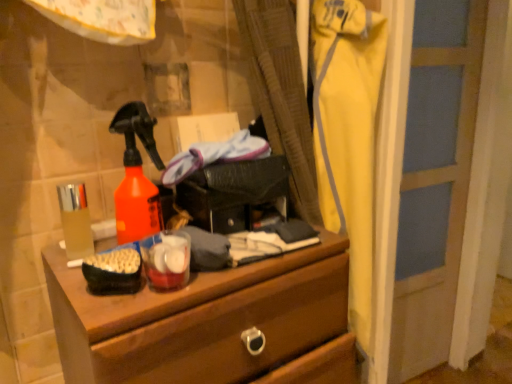
Find the location of a particular element. This screenshot has height=384, width=512. wooden chest of drawers at center is located at coordinates (x=201, y=320).

In the scene shown: Considering the relative positions of wooden chest of drawers at center and yellow fabric pants at right in the image provided, is wooden chest of drawers at center to the left of yellow fabric pants at right from the viewer's perspective?

Indeed, wooden chest of drawers at center is positioned on the left side of yellow fabric pants at right.

You are a GUI agent. You are given a task and a screenshot of the screen. Output one action in this format:
    pyautogui.click(x=<x>, y=<y>)
    Task: Click on the clothing that appears above the wooden chest of drawers at center (from a real-world perspective)
    
    Given the screenshot: What is the action you would take?
    pyautogui.click(x=348, y=135)

Which is closer to the camera, (265, 265) or (348, 88)?

Point (265, 265)

From the image's perspective, between wooden chest of drawers at center and yellow fabric pants at right, which one is located above?

From the image's view, yellow fabric pants at right is above.

Is yellow fabric pants at right thinner than wooden chest of drawers at center?

Correct, the width of yellow fabric pants at right is less than that of wooden chest of drawers at center.

Between yellow fabric pants at right and wooden chest of drawers at center, which one is positioned behind?

yellow fabric pants at right is more distant.

From a real-world perspective, between yellow fabric pants at right and wooden chest of drawers at center, who is vertically lower?

From a 3D spatial view, wooden chest of drawers at center is below.

Which is more to the left, wooden chest of drawers at center or translucent plastic cup at left?

From the viewer's perspective, translucent plastic cup at left appears more on the left side.

Does wooden chest of drawers at center have a larger size compared to translucent plastic cup at left?

Indeed, wooden chest of drawers at center has a larger size compared to translucent plastic cup at left.

Does wooden chest of drawers at center have a lesser width compared to translucent plastic cup at left?

Incorrect, the width of wooden chest of drawers at center is not less than that of translucent plastic cup at left.

Is wooden chest of drawers at center not within translucent plastic cup at left?

wooden chest of drawers at center is positioned outside translucent plastic cup at left.

From the image's perspective, would you say translucent plastic cup at left is positioned over wooden chest of drawers at center?

Yes, from the image's perspective, translucent plastic cup at left is over wooden chest of drawers at center.

Is translucent plastic cup at left in contact with wooden chest of drawers at center?

translucent plastic cup at left is not next to wooden chest of drawers at center, and they're not touching.

Can you confirm if translucent plastic cup at left is thinner than wooden chest of drawers at center?

Yes, translucent plastic cup at left is thinner than wooden chest of drawers at center.

Is translucent plastic cup at left smaller than wooden chest of drawers at center?

Correct, translucent plastic cup at left occupies less space than wooden chest of drawers at center.

From the picture: Is translucent plastic cup at left positioned with its back to yellow fabric pants at right?

No, translucent plastic cup at left is not facing the opposite direction of yellow fabric pants at right.

From the image's perspective, which one is positioned higher, translucent plastic cup at left or yellow fabric pants at right?

translucent plastic cup at left.

Which object is positioned more to the right, translucent plastic cup at left or yellow fabric pants at right?

yellow fabric pants at right.

Does translucent plastic cup at left touch yellow fabric pants at right?

There is a gap between translucent plastic cup at left and yellow fabric pants at right.

Is yellow fabric pants at right positioned far away from translucent plastic cup at left?

No, yellow fabric pants at right is not far away from translucent plastic cup at left.

Does yellow fabric pants at right appear on the left side of translucent plastic cup at left?

No, yellow fabric pants at right is not to the left of translucent plastic cup at left.

Is yellow fabric pants at right not within translucent plastic cup at left?

Indeed, yellow fabric pants at right is completely outside translucent plastic cup at left.

Locate an element on the screen. Image resolution: width=512 pixels, height=384 pixels. chest of drawers that appears on the left of yellow fabric pants at right is located at coordinates (201, 320).

Identify the location of the chest of drawers beneath the yellow fabric pants at right (from a real-world perspective). (201, 320).

Looking at the image, which one is located closer to translucent plastic cup at left, wooden chest of drawers at center or yellow fabric pants at right?

wooden chest of drawers at center.

Estimate the real-world distances between objects in this image. Which object is closer to translucent plastic cup at left, yellow fabric pants at right or wooden chest of drawers at center?

wooden chest of drawers at center.

Looking at the image, which one is located closer to wooden chest of drawers at center, yellow fabric pants at right or translucent plastic cup at left?

translucent plastic cup at left is positioned closer to the anchor wooden chest of drawers at center.

From the image, which object appears to be farther from wooden chest of drawers at center, translucent plastic cup at left or yellow fabric pants at right?

yellow fabric pants at right.

Looking at this image, looking at the image, which one is located closer to yellow fabric pants at right, wooden chest of drawers at center or translucent plastic cup at left?

Among the two, wooden chest of drawers at center is located nearer to yellow fabric pants at right.

Estimate the real-world distances between objects in this image. Which object is closer to yellow fabric pants at right, translucent plastic cup at left or wooden chest of drawers at center?

wooden chest of drawers at center.

At what (x,y) coordinates should I click in order to perform the action: click on chest of drawers between translucent plastic cup at left and yellow fabric pants at right from left to right. Please return your answer as a coordinate pair (x, y). Looking at the image, I should click on (201, 320).